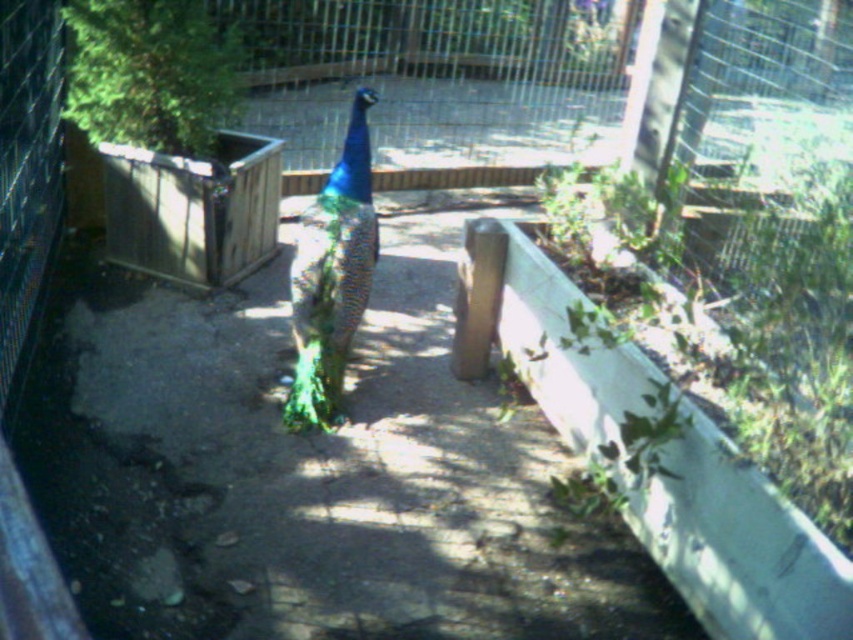
Which is behind, point (186, 596) or point (207, 22)?

The point (207, 22) is behind.

Who is shorter, green iridescent peacock at center or green leafy plant at upper left?

green leafy plant at upper left is shorter.

Does point (357, 452) come in front of point (198, 67)?

Yes, point (357, 452) is closer to viewer.

Locate an element on the screen. This screenshot has height=640, width=853. green iridescent peacock at center is located at coordinates (306, 476).

Can you confirm if green leafy plant at upper left is positioned to the right of shiny iridescent peacock at center?

Incorrect, green leafy plant at upper left is not on the right side of shiny iridescent peacock at center.

Can you confirm if green leafy plant at upper left is positioned to the left of shiny iridescent peacock at center?

Indeed, green leafy plant at upper left is positioned on the left side of shiny iridescent peacock at center.

The height and width of the screenshot is (640, 853). I want to click on green leafy plant at upper left, so click(151, 74).

Is green iridescent peacock at center in front of shiny iridescent peacock at center?

Yes, it is.

In order to click on green iridescent peacock at center in this screenshot , I will do `click(306, 476)`.

Who is more forward, (267,484) or (325,252)?

Positioned in front is point (267,484).

This screenshot has width=853, height=640. Identify the location of green iridescent peacock at center. (306, 476).